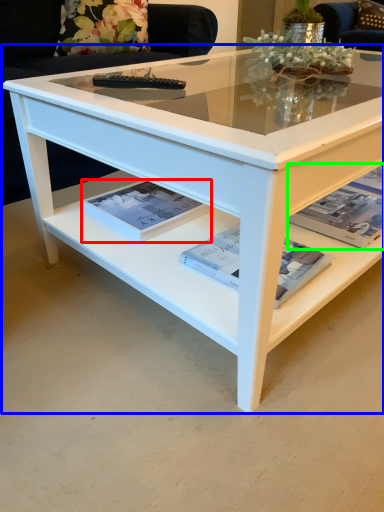
Question: Which object is the closest to the magazine (highlighted by a red box)? Choose among these: coffee table (highlighted by a blue box) or magazine (highlighted by a green box).

Choices:
 (A) coffee table
 (B) magazine

Answer: (A)